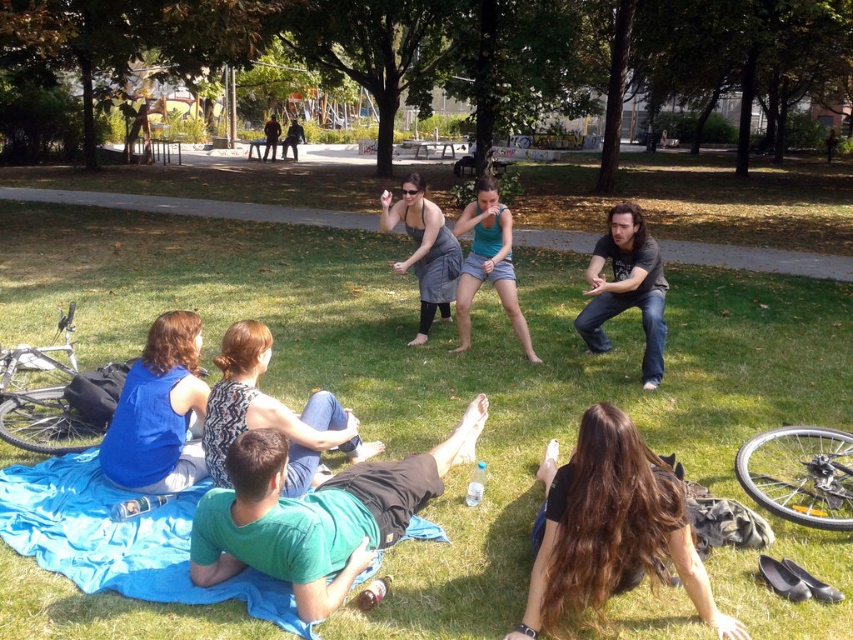
You are standing at the edge of the park pathway and see the printed fabric dress at center and the black leather shoes at lower right. Which object is closer to your right side?

The black leather shoes at lower right is positioned on the right side of the printed fabric dress at center, so it is closer to your right side.

You are a photographer standing at the edge of the park pathway. You notice the blue fabric at lower left and the gray fabric dress at center in your viewfinder. Which fabric is closer to the ground?

The blue fabric at lower left is positioned under the gray fabric dress at center, so it is closer to the ground.

You are a photographer trying to capture a candid shot of the printed fabric dress at center without including the black leather shoes at lower right in the frame. Based on their positions, is this possible?

The black leather shoes at lower right is in front of the printed fabric dress at center, so it would block the view. Therefore, capturing the printed fabric dress at center without including the black leather shoes at lower right in the frame is not possible.